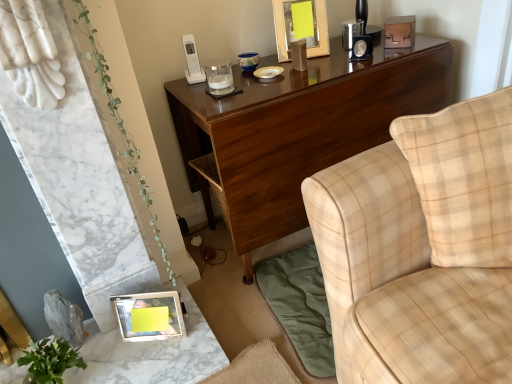
Image resolution: width=512 pixels, height=384 pixels. I want to click on vacant space to the left of metallic silver photo frame at lower left, positioned as the second picture frame in top-to-bottom order, so click(x=106, y=346).